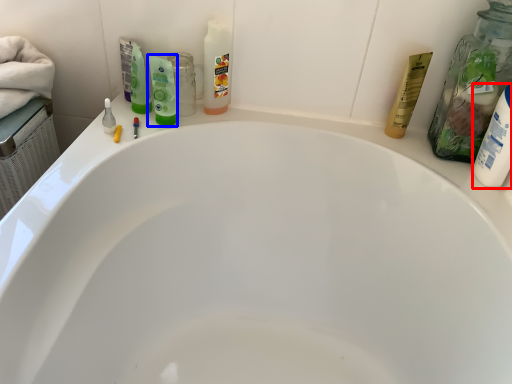
Question: Which point is further to the camera, toiletry (highlighted by a red box) or mouthwash (highlighted by a blue box)?

Choices:
 (A) toiletry
 (B) mouthwash

Answer: (B)